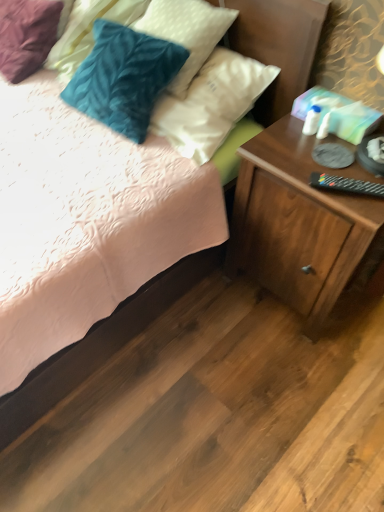
This screenshot has height=512, width=384. What are the coordinates of `free space to the back side of black plastic remote control at right` in the screenshot? It's located at (327, 151).